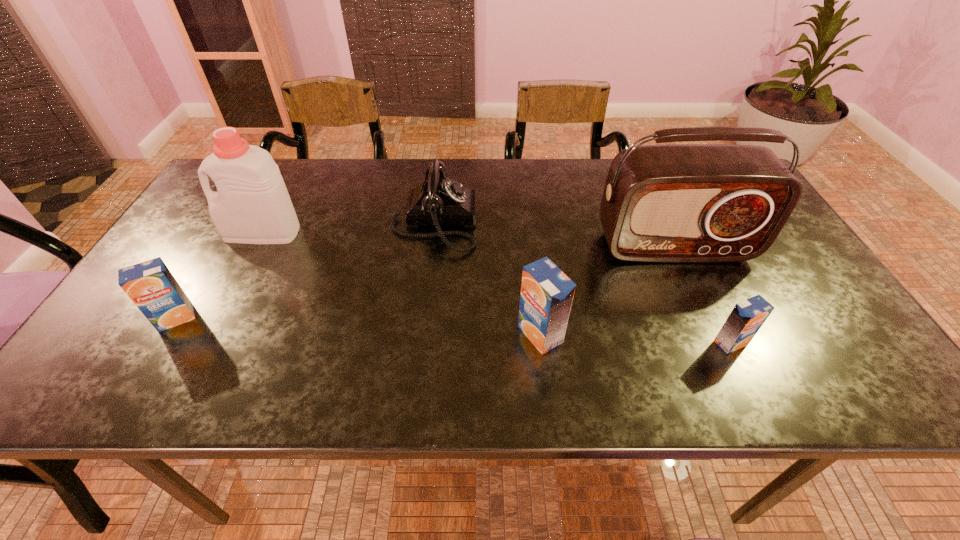
Locate an element on the screen. The image size is (960, 540). free point at the far edge is located at coordinates (572, 195).

In the image, there is a desktop. Identify the location of free space at the near edge. (511, 341).

Find the location of a particular element. The height and width of the screenshot is (540, 960). vacant area at the left edge is located at coordinates (206, 241).

You are a GUI agent. You are given a task and a screenshot of the screen. Output one action in this format:
    pyautogui.click(x=<x>, y=<y>)
    Task: Click on the vacant space at the far left corner
    This screenshot has width=960, height=540.
    Given the screenshot: What is the action you would take?
    pyautogui.click(x=204, y=201)

Where is `vacant space at the near right corner`? vacant space at the near right corner is located at coordinates (799, 332).

The width and height of the screenshot is (960, 540). What are the coordinates of `free spot between the third object from left to right and the radio receiver` in the screenshot? It's located at (554, 234).

At what (x,y) coordinates should I click in order to perform the action: click on empty location between the fourth object from right to left and the detergent. Please return your answer as a coordinate pair (x, y). Looking at the image, I should click on pos(348,227).

Where is `free space between the second shortest orange_juice and the second orange_juice from right to left`? Image resolution: width=960 pixels, height=540 pixels. free space between the second shortest orange_juice and the second orange_juice from right to left is located at coordinates (358, 326).

Identify the location of free space between the leftmost orange_juice and the radio receiver. The width and height of the screenshot is (960, 540). (425, 282).

This screenshot has width=960, height=540. Identify the location of free space between the rightmost orange_juice and the radio receiver. (703, 294).